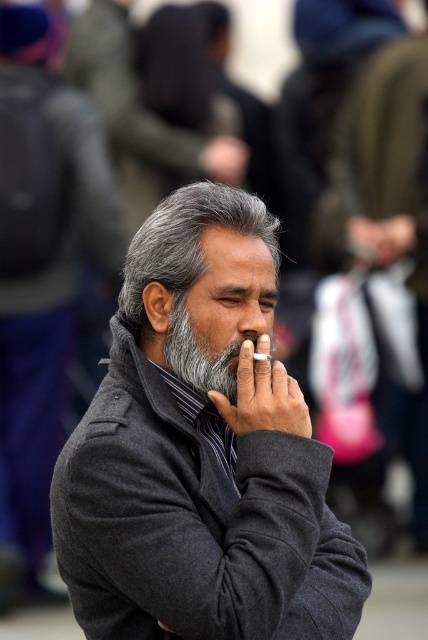
Question: Which of the following is the farthest from the observer?

Choices:
 (A) (11, 161)
 (B) (228, 368)
 (C) (255, 353)

Answer: (A)

Question: Is dark gray wool coat at center positioned in front of gray matte nose at center?

Choices:
 (A) no
 (B) yes

Answer: (B)

Question: Estimate the real-world distances between objects in this image. Which object is farther from the white paper cigarette at center?

Choices:
 (A) gray matte beard at center
 (B) gray wool coat at center

Answer: (B)

Question: Can you confirm if gray matte nose at center is positioned to the left of white paper cigarette at center?

Choices:
 (A) no
 (B) yes

Answer: (B)

Question: Which point appears closest to the camera in this image?

Choices:
 (A) (272, 604)
 (B) (250, 337)
 (C) (267, 356)
 (D) (32, 141)

Answer: (A)

Question: Can you confirm if gray wool coat at center is positioned to the left of gray matte nose at center?

Choices:
 (A) no
 (B) yes

Answer: (B)